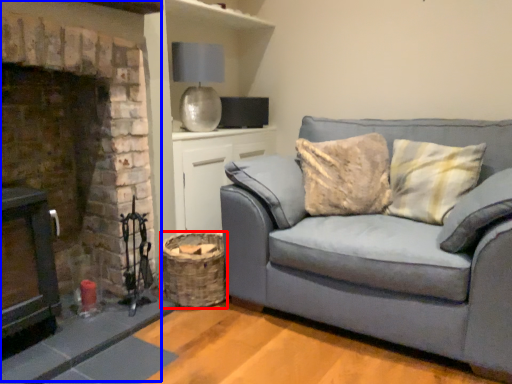
Question: Which object is closer to the camera taking this photo, basket (highlighted by a red box) or fireplace (highlighted by a blue box)?

Choices:
 (A) basket
 (B) fireplace

Answer: (B)